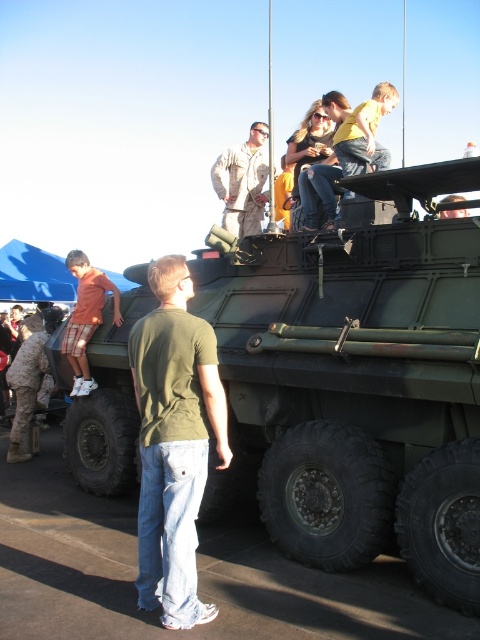
You are a photographer at the event and want to capture a photo of both the green cotton shirt at center and the matte red shorts at left. Based on their positions, which one should you focus on first to ensure both are in the frame?

The green cotton shirt at center is located below the matte red shorts at left, so you should focus on the matte red shorts at left first to ensure both are in the frame.

You are a photographer at the event and want to capture a photo of the green cotton shirt at center. Where should you aim your camera to ensure the shirt is in the frame?

You should aim your camera at point (x=173, y=442) to capture the green cotton shirt at center in the frame.